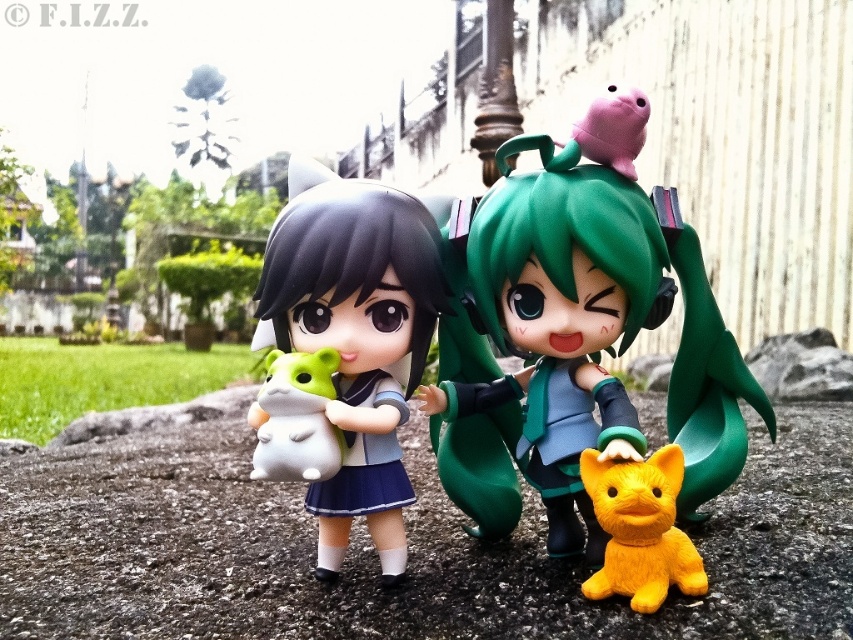
Which of these two, satin white plush at center or white matte plush toy at left, stands taller?

With more height is satin white plush at center.

Which is in front, point (387, 422) or point (306, 442)?

Positioned in front is point (306, 442).

Which is behind, point (387, 260) or point (299, 413)?

The point (387, 260) is more distant.

Find the location of a particular element. Image resolution: width=853 pixels, height=640 pixels. satin white plush at center is located at coordinates (357, 337).

Is yellow rubber cat at lower right further to camera compared to white matte plush toy at left?

No, it is in front of white matte plush toy at left.

Between point (657, 488) and point (271, 451), which one is positioned behind?

The point (271, 451) is more distant.

Identify the location of yellow rubber cat at lower right. The width and height of the screenshot is (853, 640). (640, 529).

Is the position of satin white plush at center less distant than that of yellow rubber cat at lower right?

No, satin white plush at center is behind yellow rubber cat at lower right.

Describe the element at coordinates (357, 337) in the screenshot. The height and width of the screenshot is (640, 853). I see `satin white plush at center` at that location.

The height and width of the screenshot is (640, 853). Find the location of `satin white plush at center`. satin white plush at center is located at coordinates (357, 337).